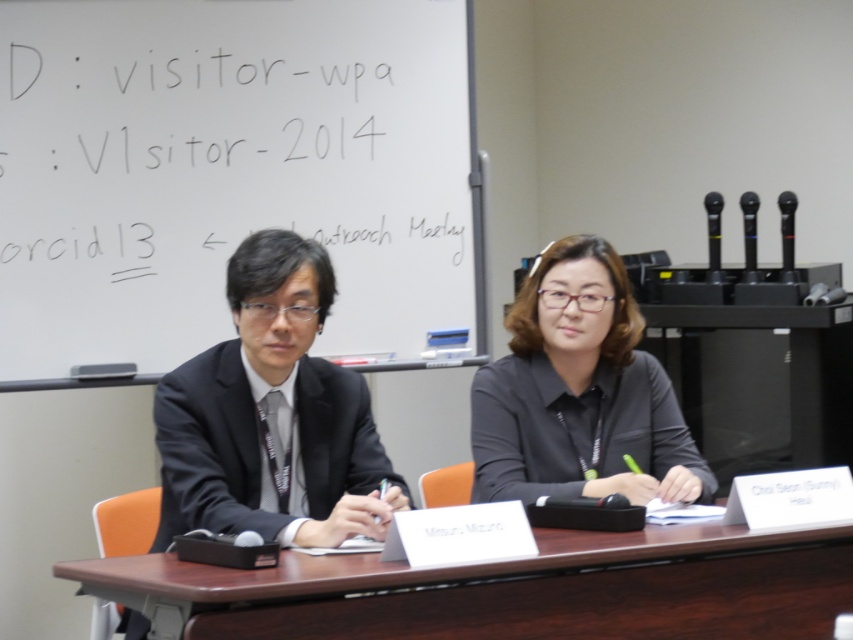
Question: Can you confirm if black suit at center is thinner than black matte shirt at center?

Choices:
 (A) yes
 (B) no

Answer: (B)

Question: Which point is farther to the camera?

Choices:
 (A) black matte shirt at center
 (B) whiteboard at upper left

Answer: (B)

Question: Is brown wood table at center behind black matte shirt at center?

Choices:
 (A) no
 (B) yes

Answer: (A)

Question: Which of the following is the closest to the observer?

Choices:
 (A) (560, 339)
 (B) (265, 444)
 (C) (415, 141)

Answer: (B)

Question: Does black suit at center appear over black matte shirt at center?

Choices:
 (A) yes
 (B) no

Answer: (B)

Question: Which point is farther from the camera taking this photo?

Choices:
 (A) (659, 483)
 (B) (741, 529)
 (C) (280, 428)

Answer: (A)